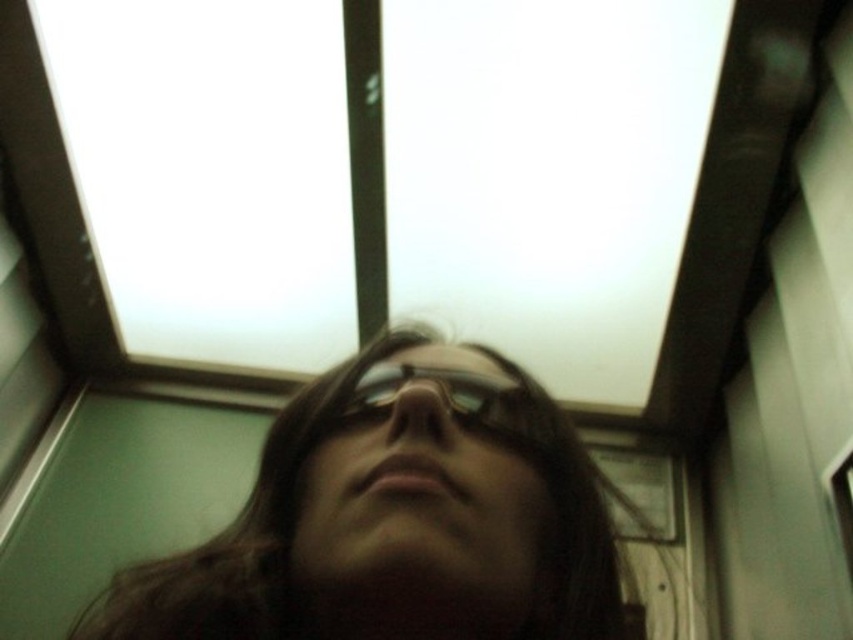
Find the location of a particular element. This screenshot has height=640, width=853. matte black hair at center is located at coordinates (264, 541).

In the scene shown: Which is more to the left, matte black hair at center or black reflective glasses at center?

Positioned to the left is black reflective glasses at center.

Between point (521, 461) and point (375, 392), which one is positioned behind?

Point (375, 392)

The width and height of the screenshot is (853, 640). In order to click on matte black hair at center in this screenshot , I will do `click(264, 541)`.